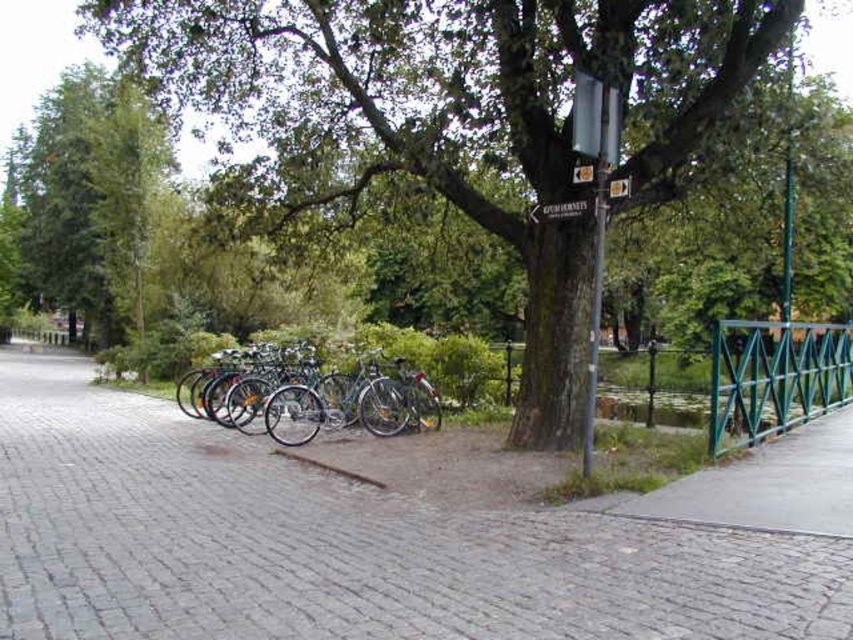
Between shiny metallic bicycles at center and metallic pole at center-right, which one has less height?

With less height is shiny metallic bicycles at center.

Is point (329, 394) more distant than point (595, 392)?

Yes.

This screenshot has width=853, height=640. I want to click on shiny metallic bicycles at center, so click(308, 394).

Is concrete pavement at lower right thinner than black plastic sign at upper center?

No, concrete pavement at lower right is not thinner than black plastic sign at upper center.

Can you confirm if concrete pavement at lower right is positioned below black plastic sign at upper center?

Yes, concrete pavement at lower right is below black plastic sign at upper center.

Who is more distant from viewer, (840, 472) or (585, 205)?

The point (585, 205) is more distant.

Where is `concrete pavement at lower right`? concrete pavement at lower right is located at coordinates (764, 484).

Does metallic pole at center-right have a greater width compared to green metal fence at right?

Incorrect, metallic pole at center-right's width does not surpass green metal fence at right's.

What do you see at coordinates (595, 323) in the screenshot? I see `metallic pole at center-right` at bounding box center [595, 323].

You are a GUI agent. You are given a task and a screenshot of the screen. Output one action in this format:
    pyautogui.click(x=<x>, y=<y>)
    Task: Click on the metallic pole at center-right
    
    Given the screenshot: What is the action you would take?
    pyautogui.click(x=595, y=323)